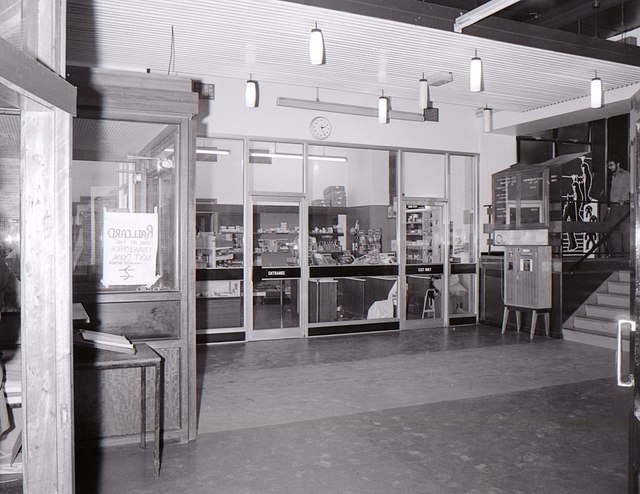
At what (x,y) coordinates should I click in order to perform the action: click on stairs. Please return your answer as a coordinate pair (x, y). Image resolution: width=640 pixels, height=494 pixels. Looking at the image, I should click on (620, 312).